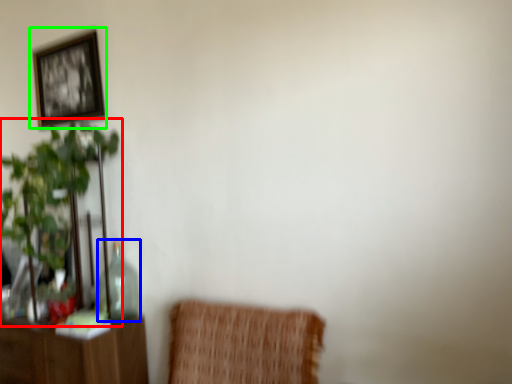
Question: Considering the real-world distances, which object is closest to houseplant (highlighted by a red box)? glass vase (highlighted by a blue box) or picture frame (highlighted by a green box).

Choices:
 (A) glass vase
 (B) picture frame

Answer: (A)